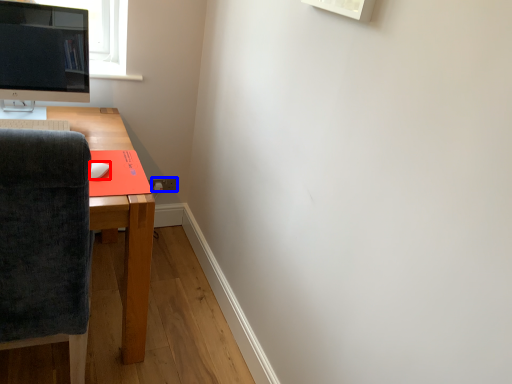
Question: Among these objects, which one is nearest to the camera, mouse (highlighted by a red box) or power outlet (highlighted by a blue box)?

Choices:
 (A) mouse
 (B) power outlet

Answer: (A)